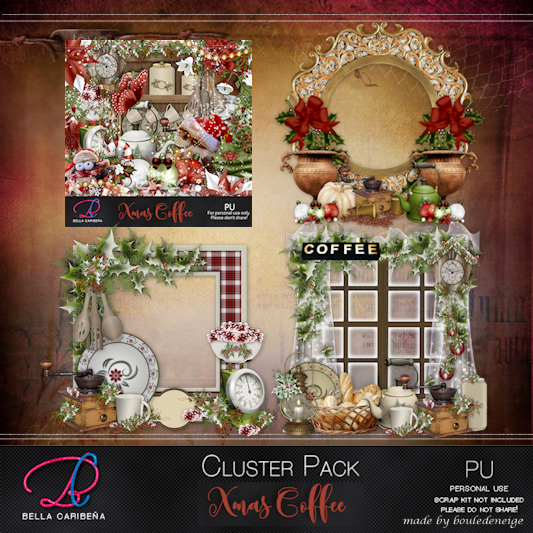
The width and height of the screenshot is (533, 533). What are the coordinates of `brown bread basket` in the screenshot? It's located at (341, 422).